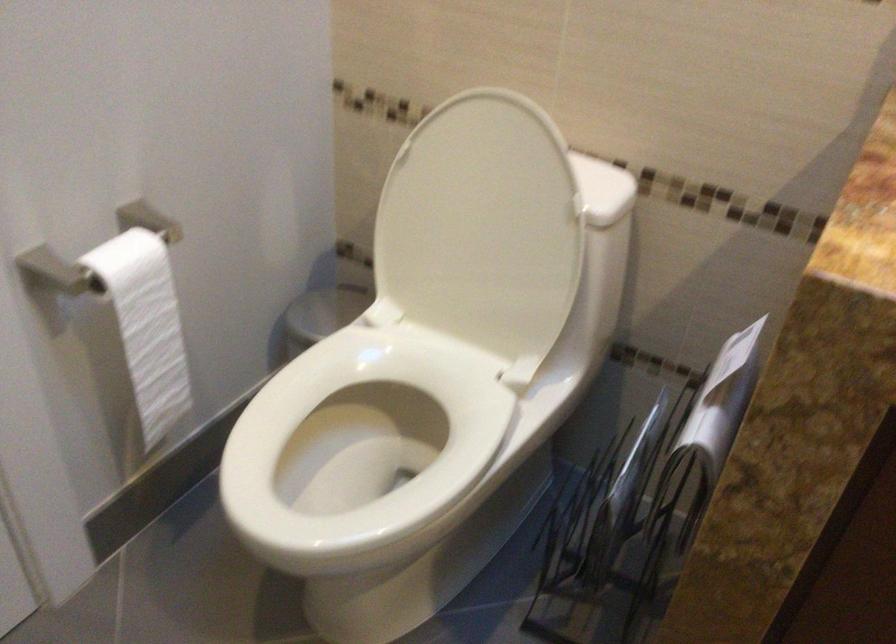
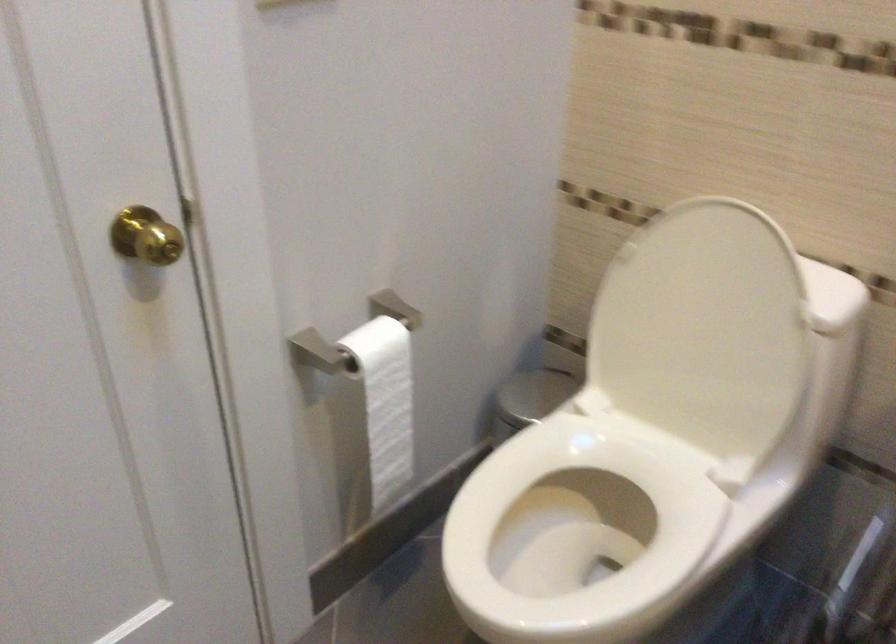
Find the pixel in the second image that matches pixel 376 446 in the first image.

(581, 531)